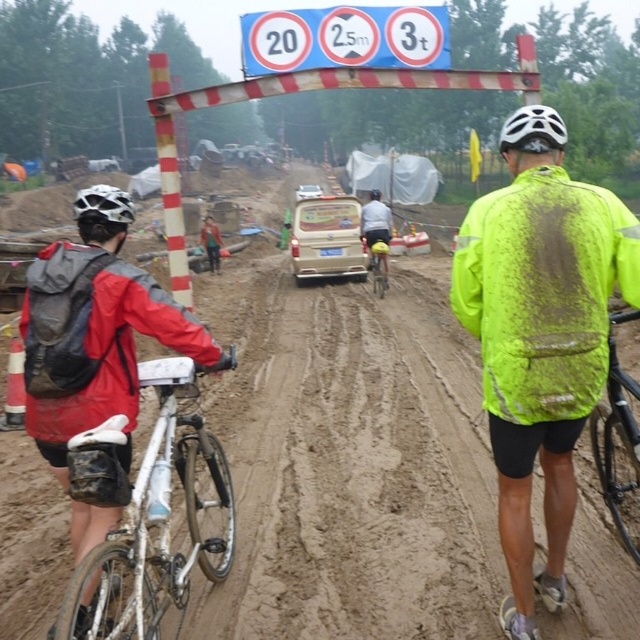
Is neon yellow jacket at rear wider than black matte mountain bike at center?

Incorrect, neon yellow jacket at rear's width does not surpass black matte mountain bike at center's.

Does neon yellow jacket at rear appear on the left side of black matte mountain bike at center?

Yes, neon yellow jacket at rear is to the left of black matte mountain bike at center.

Locate an element on the screen. neon yellow jacket at rear is located at coordinates click(544, 291).

Can you confirm if white matte bicycle helmet at upper center is smaller than matte black helmet at upper left?

Yes, white matte bicycle helmet at upper center is smaller than matte black helmet at upper left.

Does white matte bicycle helmet at upper center have a lesser height compared to matte black helmet at upper left?

Incorrect, white matte bicycle helmet at upper center's height does not fall short of matte black helmet at upper left's.

Identify the location of white matte bicycle helmet at upper center. (532, 131).

Is white matte bicycle helmet at upper center smaller than yellow matte bicycle at center?

Incorrect, white matte bicycle helmet at upper center is not smaller in size than yellow matte bicycle at center.

Describe the element at coordinates (532, 131) in the screenshot. Image resolution: width=640 pixels, height=640 pixels. I see `white matte bicycle helmet at upper center` at that location.

Locate an element on the screen. white matte bicycle helmet at upper center is located at coordinates (532, 131).